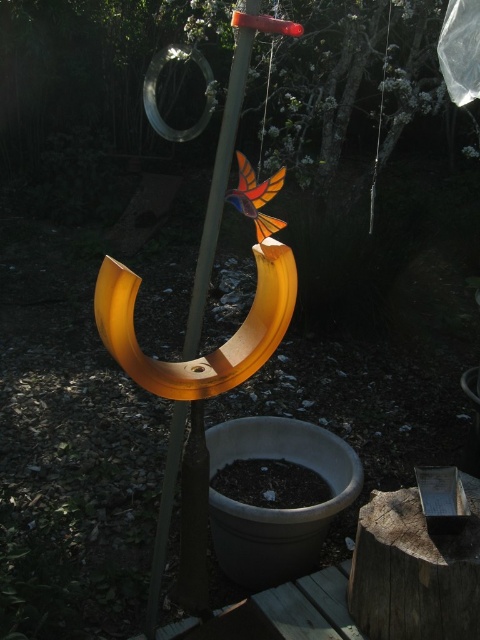
Does transparent plastic bird at center lie behind translucent plastic pole at center?

Yes, transparent plastic bird at center is behind translucent plastic pole at center.

Is point (172, 58) farther from camera compared to point (164, 541)?

Yes, point (172, 58) is farther from viewer.

Image resolution: width=480 pixels, height=640 pixels. I want to click on transparent plastic bird at center, so (100, 81).